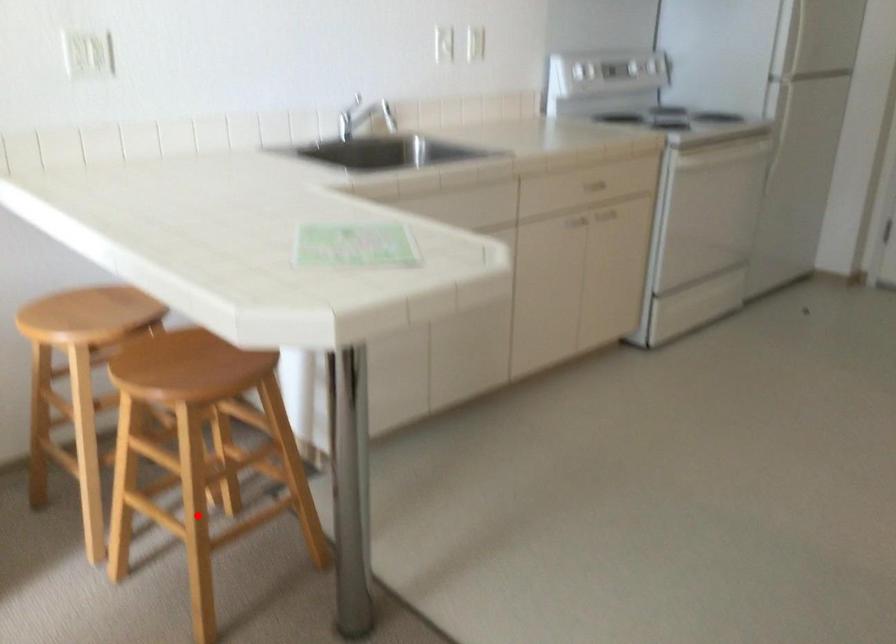
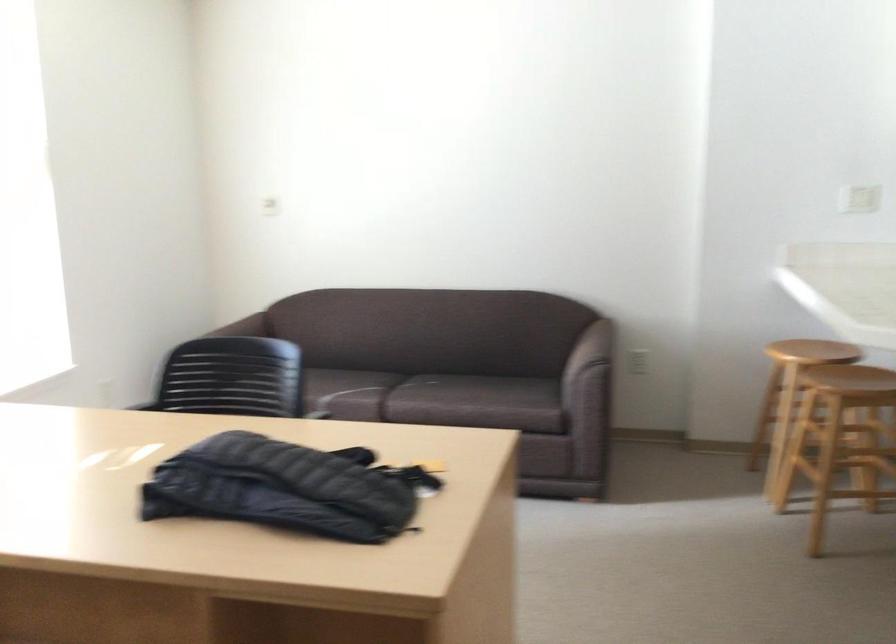
Locate, in the second image, the point that corresponds to the highlighted location in the first image.

(837, 466)